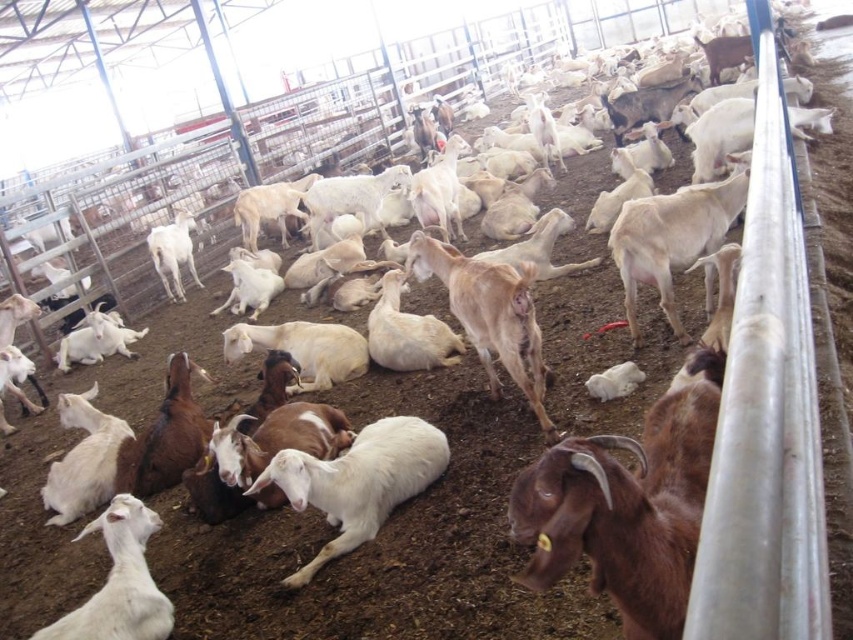
Is brown fuzzy goat at lower right to the left of white woolen goat at center from the viewer's perspective?

Incorrect, brown fuzzy goat at lower right is not on the left side of white woolen goat at center.

Does point (686, 589) lie in front of point (380, 486)?

Yes, point (686, 589) is in front of point (380, 486).

What do you see at coordinates (627, 504) in the screenshot? Image resolution: width=853 pixels, height=640 pixels. I see `brown fuzzy goat at lower right` at bounding box center [627, 504].

Locate an element on the screen. The height and width of the screenshot is (640, 853). brown fuzzy goat at lower right is located at coordinates (627, 504).

Which is above, brown fuzzy goat at lower right or white woolen goat at lower left?

brown fuzzy goat at lower right

Who is lower down, brown fuzzy goat at lower right or white woolen goat at lower left?

white woolen goat at lower left

Is point (656, 448) less distant than point (126, 563)?

Yes, it is in front of point (126, 563).

Where is `brown fuzzy goat at lower right`? The image size is (853, 640). brown fuzzy goat at lower right is located at coordinates (627, 504).

Measure the distance from white woolen goat at center to white woolen goat at lower left.

A distance of 26.46 inches exists between white woolen goat at center and white woolen goat at lower left.

Who is more forward, (315, 500) or (131, 547)?

Point (131, 547)

The height and width of the screenshot is (640, 853). I want to click on white woolen goat at center, so click(x=358, y=481).

Locate an element on the screen. The height and width of the screenshot is (640, 853). white woolen goat at center is located at coordinates (358, 481).